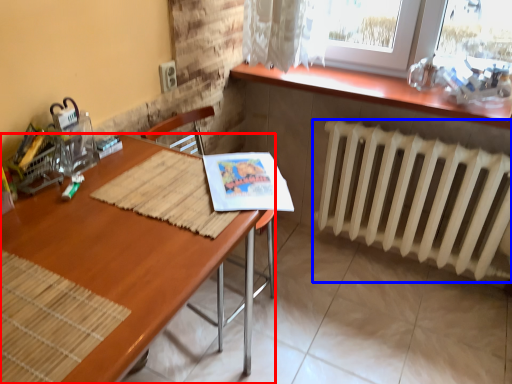
Question: Which point is further to the camera, desk (highlighted by a red box) or radiator (highlighted by a blue box)?

Choices:
 (A) desk
 (B) radiator

Answer: (B)